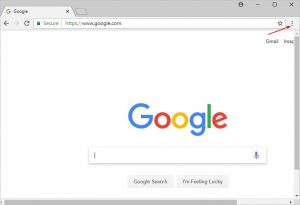
Identify the location of exit icon. (69, 10), (292, 4).